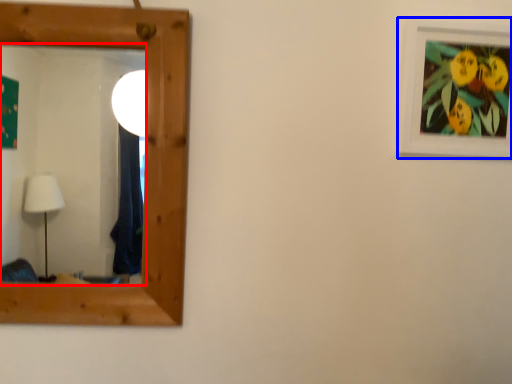
Question: Which point is further to the camera, mirror (highlighted by a red box) or picture frame (highlighted by a blue box)?

Choices:
 (A) mirror
 (B) picture frame

Answer: (B)